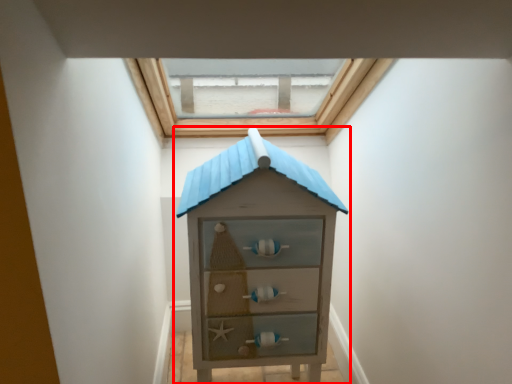
Question: From the image's perspective, where is chest of drawers (annotated by the red box) located relative to window?

Choices:
 (A) below
 (B) above

Answer: (A)